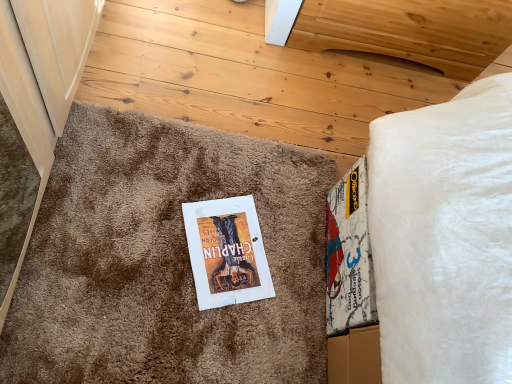
The image size is (512, 384). I want to click on vacant area to the right of white paper book at center, so click(x=285, y=292).